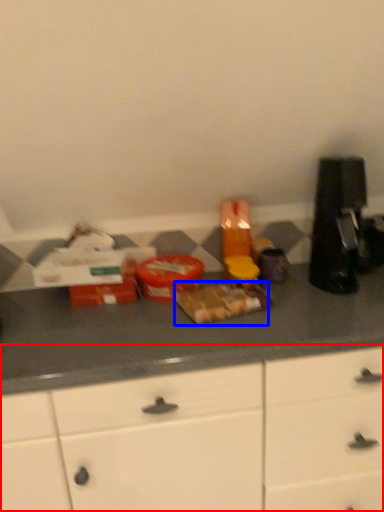
Question: Which point is further to the camera, cabinetry (highlighted by a red box) or food (highlighted by a blue box)?

Choices:
 (A) cabinetry
 (B) food

Answer: (B)